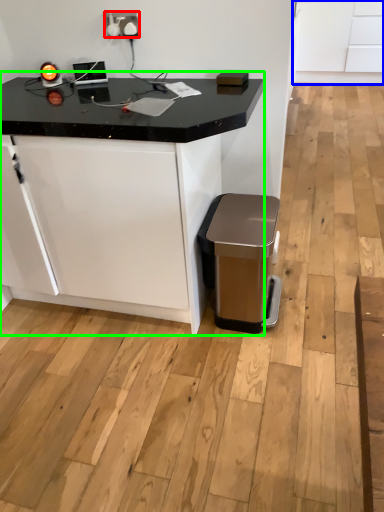
Question: Based on their relative distances, which object is farther from electric outlet (highlighted by a red box)? Choose from cabinetry (highlighted by a blue box) and table (highlighted by a green box).

Choices:
 (A) cabinetry
 (B) table

Answer: (A)